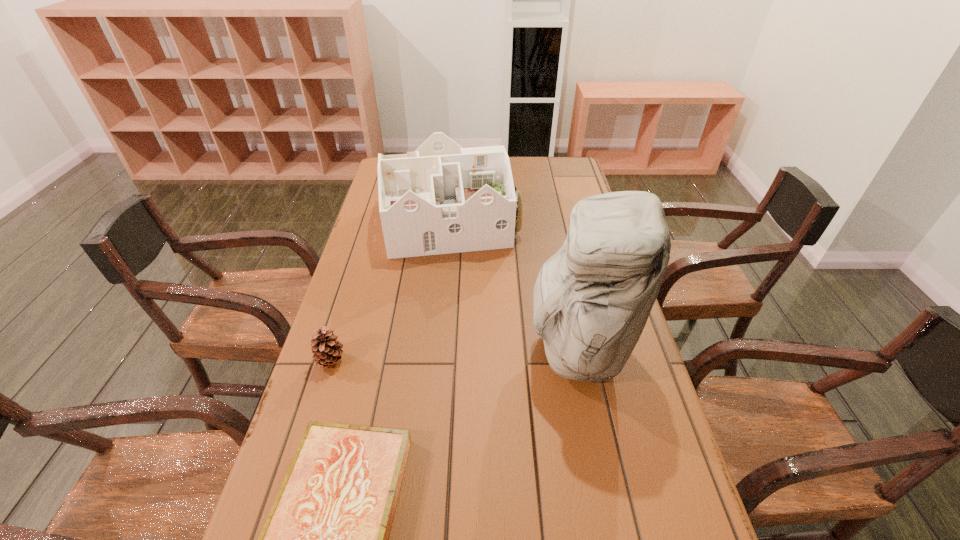
Where is `pinecone at the left edge`? This screenshot has width=960, height=540. pinecone at the left edge is located at coordinates (326, 350).

At what (x,y) coordinates should I click in order to perform the action: click on object located in the right edge section of the desktop. Please return your answer as a coordinate pair (x, y). Looking at the image, I should click on (591, 301).

I want to click on vacant space at the left edge of the desktop, so click(373, 323).

I want to click on free region at the right edge of the desktop, so click(670, 472).

At what (x,y) coordinates should I click in order to perform the action: click on free space at the far right corner. Please return your answer as a coordinate pair (x, y). Looking at the image, I should click on (580, 173).

You are a GUI agent. You are given a task and a screenshot of the screen. Output one action in this format:
    pyautogui.click(x=<x>, y=<y>)
    Task: Click on the empty space between the tallest object and the dollhouse
    The width and height of the screenshot is (960, 540).
    Given the screenshot: What is the action you would take?
    pyautogui.click(x=514, y=285)

The width and height of the screenshot is (960, 540). In order to click on vacant point located between the farthest object and the third tallest object in this screenshot , I will do `click(391, 292)`.

At what (x,y) coordinates should I click in order to perform the action: click on empty space that is in between the third shortest object and the pinecone. Please return your answer as a coordinate pair (x, y). Looking at the image, I should click on [x=391, y=292].

Where is `vacant point located between the pinecone and the second tallest object`? vacant point located between the pinecone and the second tallest object is located at coordinates (391, 292).

Choose which object is the nearest neighbor to the nearest object. Please provide its 2D coordinates. Your answer should be formatted as a tuple, i.e. [(x, y)], where the tuple contains the x and y coordinates of a point satisfying the conditions above.

[(326, 350)]